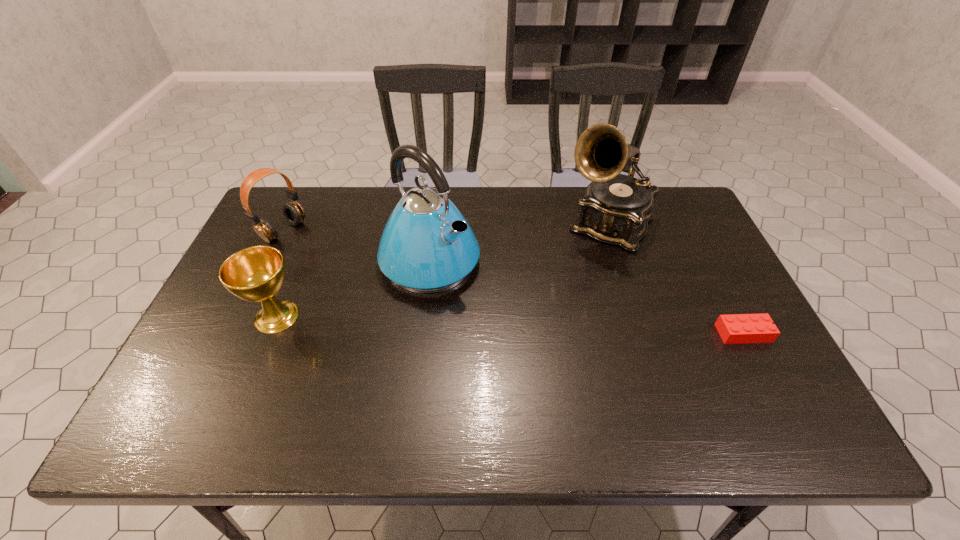
This screenshot has width=960, height=540. What are the coordinates of `vacant space in between the Lego and the fourth object from left to right` in the screenshot? It's located at (676, 279).

You are a GUI agent. You are given a task and a screenshot of the screen. Output one action in this format:
    pyautogui.click(x=<x>, y=<y>)
    Task: Click on the closest object to the rightmost object
    The image size is (960, 540).
    Given the screenshot: What is the action you would take?
    pyautogui.click(x=616, y=208)

The image size is (960, 540). I want to click on object that ranks as the second closest to the headset, so coord(427,246).

Locate an element on the screen. Image resolution: width=960 pixels, height=540 pixels. free spot that satisfies the following two spatial constraints: 1. on the back side of the second object from right to left; 2. on the right side of the chalice is located at coordinates (315, 224).